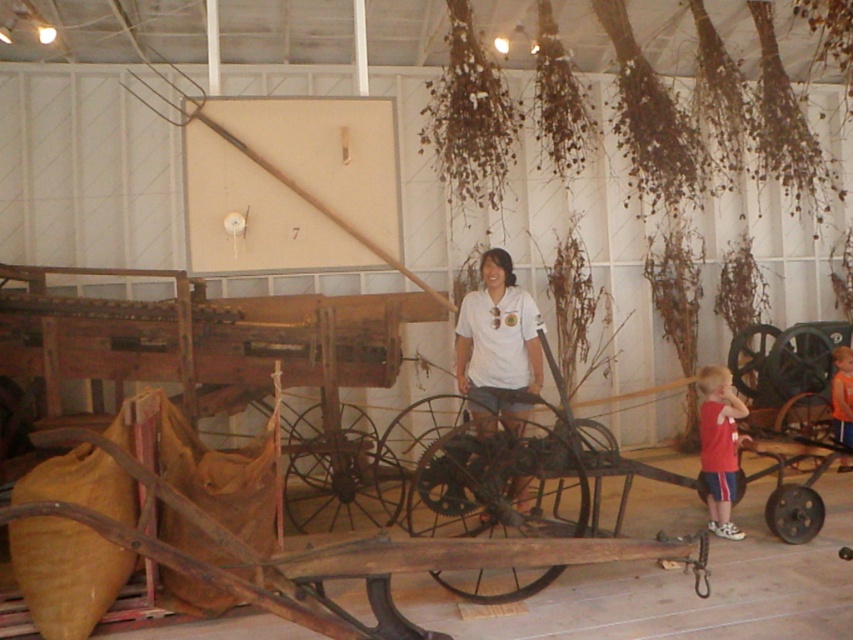
Question: Is red cotton shirt at lower right positioned in front of orange t-shirt at lower right?

Choices:
 (A) no
 (B) yes

Answer: (B)

Question: Can you confirm if red cotton shirt at lower right is smaller than orange t-shirt at lower right?

Choices:
 (A) no
 (B) yes

Answer: (B)

Question: Which point is farther to the camera?

Choices:
 (A) (502, 406)
 (B) (840, 464)

Answer: (B)

Question: Which point is farther to the camera?

Choices:
 (A) (711, 403)
 (B) (469, 372)
 (C) (840, 376)

Answer: (C)

Question: Does white matte shirt at center have a larger size compared to orange t-shirt at lower right?

Choices:
 (A) yes
 (B) no

Answer: (A)

Question: Considering the real-world distances, which object is closest to the red cotton shirt at lower right?

Choices:
 (A) white matte shirt at center
 (B) orange t-shirt at lower right

Answer: (B)